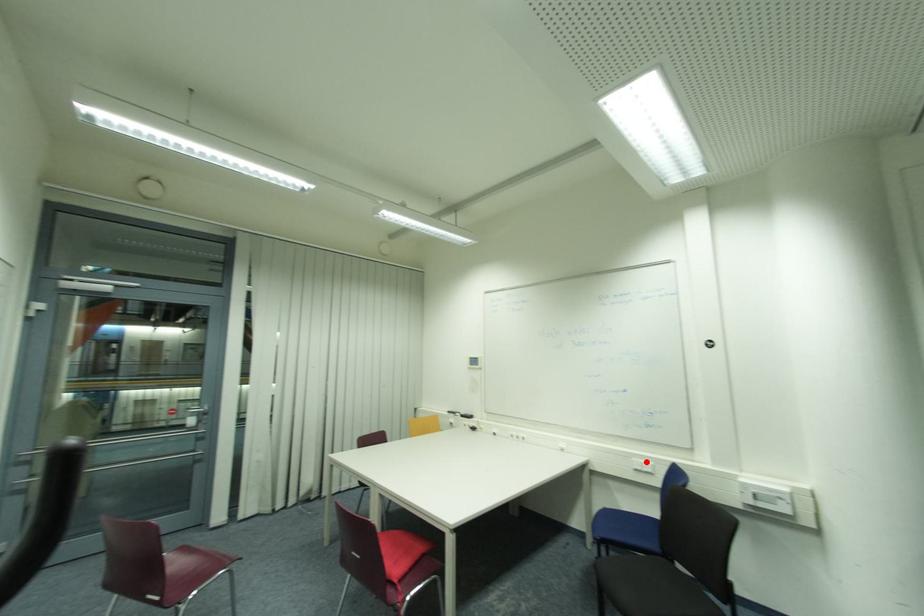
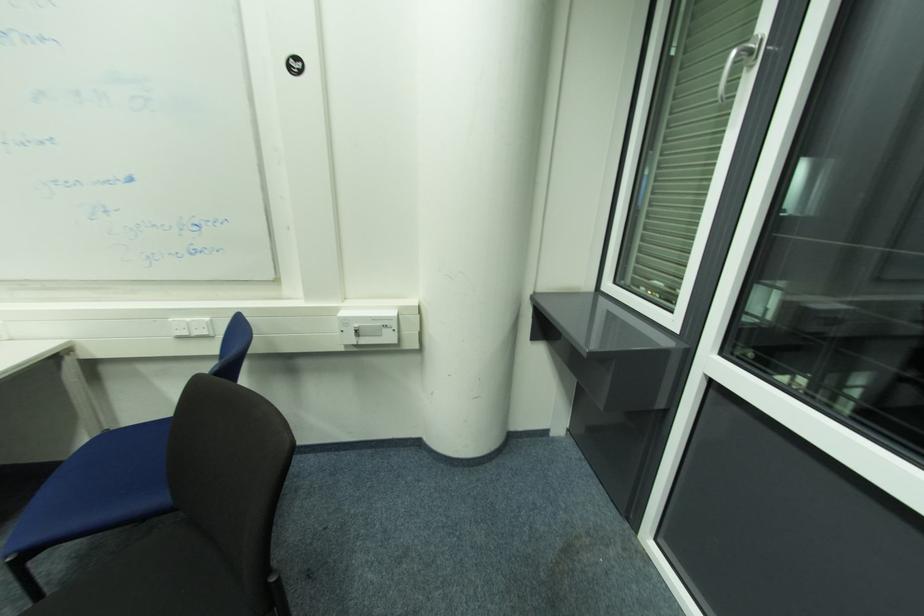
In the second image, find the point that corresponds to the highlighted location in the first image.

(191, 320)